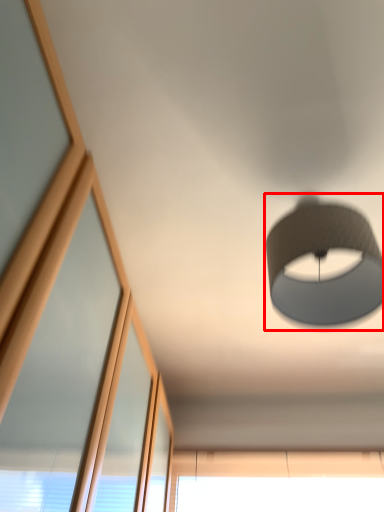
Question: From the image's perspective, what is the correct spatial relationship of lamp (annotated by the red box) in relation to window?

Choices:
 (A) above
 (B) below

Answer: (A)